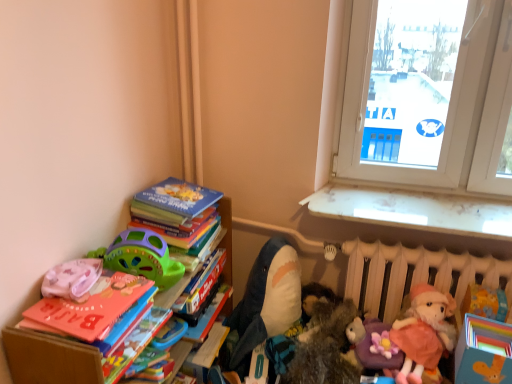
The height and width of the screenshot is (384, 512). I want to click on free point below white plastic window at upper right (from a real-world perspective), so click(x=395, y=191).